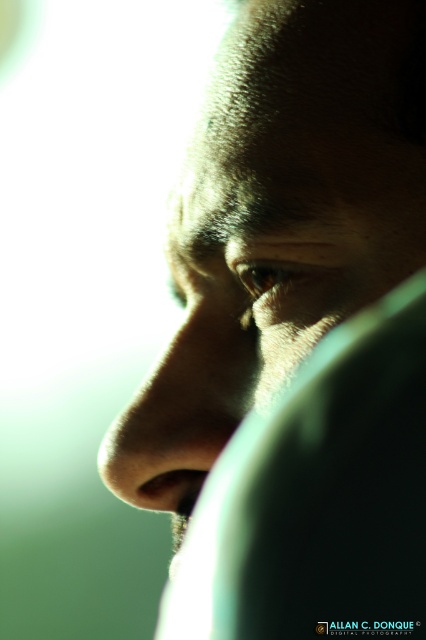
Is matte skin face at center to the right of matte skin nose at center from the viewer's perspective?

Yes, matte skin face at center is to the right of matte skin nose at center.

Locate an element on the screen. matte skin face at center is located at coordinates (279, 224).